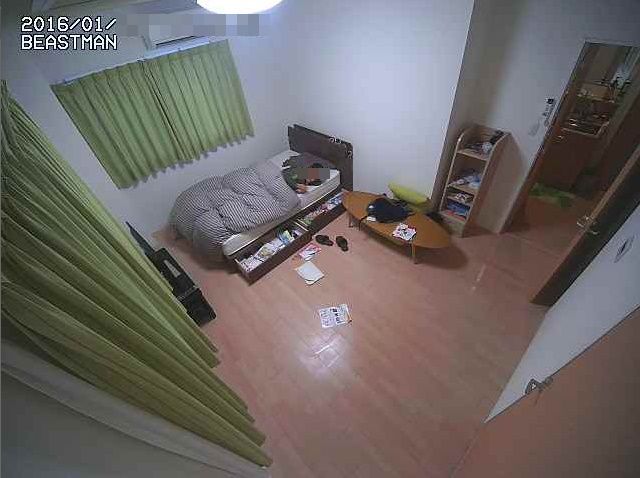
The height and width of the screenshot is (478, 640). Find the location of `green curtains covering small square window`. green curtains covering small square window is located at coordinates (171, 103).